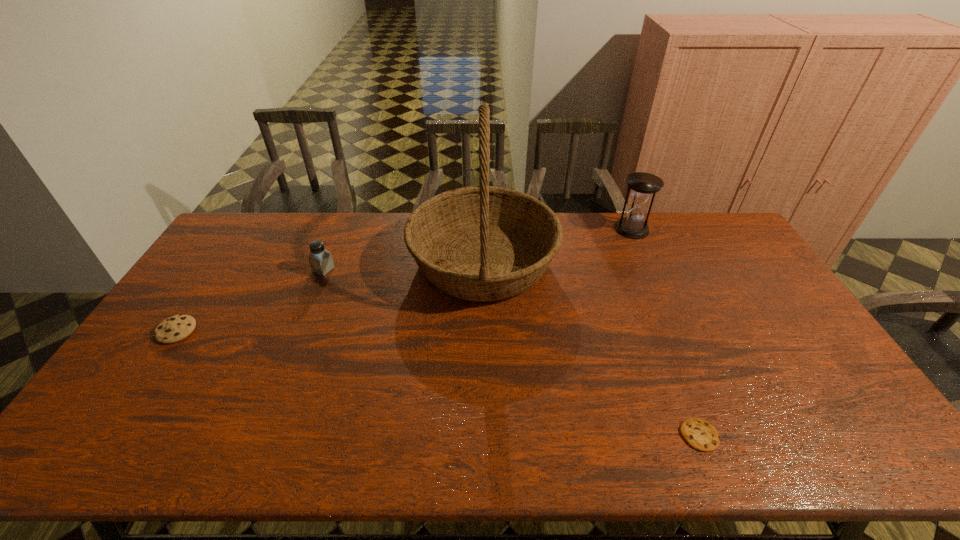
Image resolution: width=960 pixels, height=540 pixels. I want to click on blank space at the far left corner of the desktop, so click(x=262, y=235).

Locate an element on the screen. The width and height of the screenshot is (960, 540). blank space at the far right corner is located at coordinates (720, 238).

Find the location of a particular element. free spot at the near right corner of the desktop is located at coordinates (809, 430).

Locate an element on the screen. The image size is (960, 540). vacant space in between the tallest object and the left cookie is located at coordinates (330, 296).

Image resolution: width=960 pixels, height=540 pixels. In order to click on vacant point located between the saltshaker and the second shortest object in this screenshot , I will do `click(251, 300)`.

I want to click on unoccupied position between the tallest object and the nearest object, so click(591, 348).

Locate an element on the screen. vacant space that's between the hourglass and the left cookie is located at coordinates (404, 280).

Identify the location of vacant space that's between the right cookie and the saltshaker. (512, 352).

At what (x,y) coordinates should I click in order to perform the action: click on vacant area that lies between the shortest object and the third object from right to left. Please return your answer as a coordinate pair (x, y). This screenshot has width=960, height=540. Looking at the image, I should click on (591, 348).

The height and width of the screenshot is (540, 960). In order to click on vacant region between the tallest object and the farther cookie in this screenshot , I will do `click(330, 296)`.